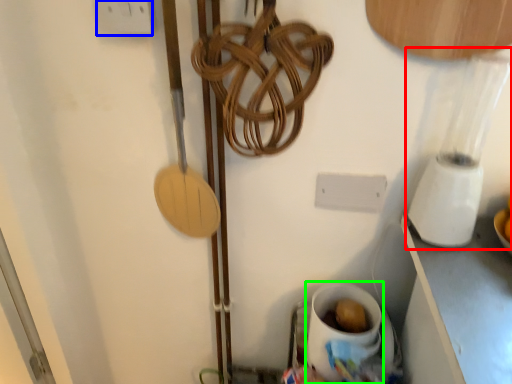
Question: Considering the real-world distances, which object is closest to blender (highlighted by a red box)? electric outlet (highlighted by a blue box) or coffee cup (highlighted by a green box).

Choices:
 (A) electric outlet
 (B) coffee cup

Answer: (B)